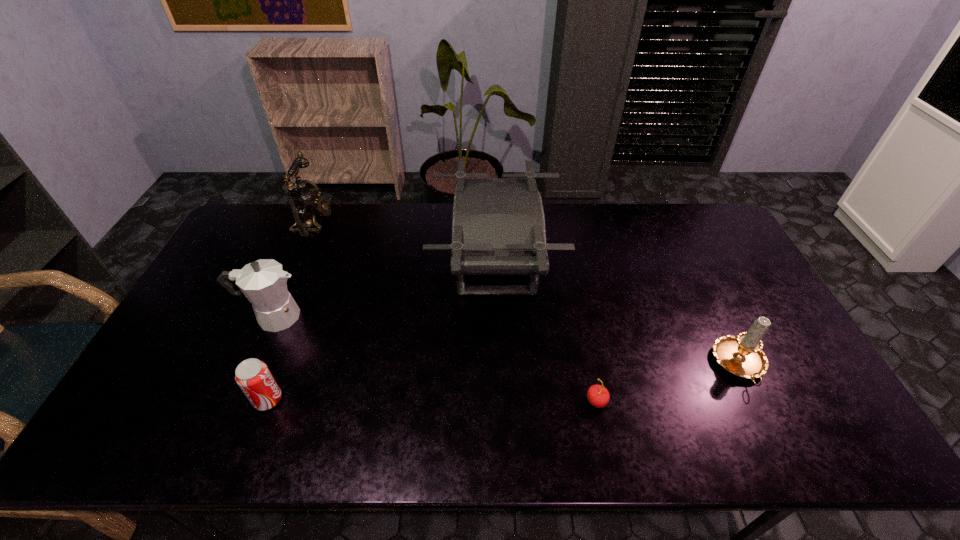
What are the coordinates of `vacant point located 0.120m with a camera mounted on the underside of the drone` in the screenshot? It's located at (397, 263).

The height and width of the screenshot is (540, 960). I want to click on vacant space located 0.400m with a camera mounted on the underside of the drone, so click(x=312, y=263).

Identify the location of free space located at the spout of the coffeepot. (369, 316).

Identify the location of vacant space located on the front of the rightmost object. (770, 428).

What are the coordinates of `free location located on the logo side of the soda can` in the screenshot? It's located at (438, 400).

The image size is (960, 540). Find the location of `vacant region located 0.310m on the back of the shortest object`. vacant region located 0.310m on the back of the shortest object is located at coordinates (576, 300).

The height and width of the screenshot is (540, 960). What are the coordinates of `telephone that is at the far edge` in the screenshot? It's located at click(x=304, y=200).

At what (x,y) coordinates should I click in order to perform the action: click on drone positioned at the far edge. Please return your answer as a coordinate pair (x, y). Image resolution: width=960 pixels, height=540 pixels. Looking at the image, I should click on (498, 224).

This screenshot has width=960, height=540. I want to click on object at the left edge, so click(263, 282).

Identify the location of object present at the right edge. (742, 355).